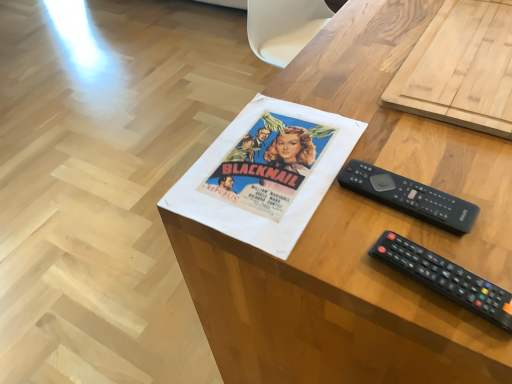
Measure the distance between woodendesk at center and camera.

woodendesk at center and camera are 16.77 inches apart.

Measure the distance between black plastic remote at center right, the first remote control positioned from the top, and camera.

black plastic remote at center right, the first remote control positioned from the top, is 21.11 inches away from camera.

The height and width of the screenshot is (384, 512). What do you see at coordinates (445, 278) in the screenshot? I see `black plastic remote at lower right, positioned as the first remote control in bottom-to-top order` at bounding box center [445, 278].

Measure the distance between black plastic remote at lower right, the first remote control positioned from the front, and camera.

They are 16.77 inches apart.

Locate an element on the screen. woodendesk at center is located at coordinates (360, 237).

From a real-world perspective, is black plastic remote at lower right, the second remote control in the back-to-front sequence, above or below woodendesk at center?

From a real-world perspective, black plastic remote at lower right, the second remote control in the back-to-front sequence, is physically above woodendesk at center.

Is black plastic remote at lower right, the first remote control positioned from the front, at the left side of woodendesk at center?

Yes, black plastic remote at lower right, the first remote control positioned from the front, is to the left of woodendesk at center.

Is black plastic remote at lower right, the second remote control in the back-to-front sequence, bigger than woodendesk at center?

No.

Is black plastic remote at lower right, the first remote control positioned from the front, taller or shorter than woodendesk at center?

Considering their sizes, black plastic remote at lower right, the first remote control positioned from the front, has less height than woodendesk at center.

How different are the orientations of woodendesk at center and black plastic remote at center right, the first remote control positioned from the top, in degrees?

The angular difference between woodendesk at center and black plastic remote at center right, the first remote control positioned from the top, is 89.8 degrees.

Is woodendesk at center positioned behind black plastic remote at center right, the second remote control from the bottom?

That is False.

How far apart are woodendesk at center and black plastic remote at center right, the 1th remote control when ordered from back to front?

9.21 inches.

Would you consider woodendesk at center to be distant from black plastic remote at center right, the second remote control from the bottom?

woodendesk at center is near black plastic remote at center right, the second remote control from the bottom, not far away.

Considering the sizes of objects woodendesk at center and black plastic remote at lower right, which is the second remote control in top-to-bottom order, in the image provided, who is wider, woodendesk at center or black plastic remote at lower right, which is the second remote control in top-to-bottom order,?

woodendesk at center is wider.

Which is behind, point (420, 305) or point (435, 258)?

The point (435, 258) is farther from the camera.

From a real-world perspective, is woodendesk at center positioned under black plastic remote at lower right, the second remote control in the back-to-front sequence, based on gravity?

Yes, from a real-world perspective, woodendesk at center is under black plastic remote at lower right, the second remote control in the back-to-front sequence.

Looking at the image, does black plastic remote at center right, the first remote control positioned from the top, seem bigger or smaller compared to woodendesk at center?

Considering their sizes, black plastic remote at center right, the first remote control positioned from the top, takes up less space than woodendesk at center.

From the image's perspective, between black plastic remote at center right, the first remote control positioned from the top, and woodendesk at center, who is located below?

black plastic remote at center right, the first remote control positioned from the top.

Where is `desk above the black plastic remote at center right, the second remote control from the bottom (from the image's perspective)`? desk above the black plastic remote at center right, the second remote control from the bottom (from the image's perspective) is located at coordinates (360, 237).

From a real-world perspective, which is physically below, black plastic remote at center right, the second remote control in the front-to-back sequence, or woodendesk at center?

From a 3D spatial view, woodendesk at center is below.

Is black plastic remote at lower right, the second remote control in the back-to-front sequence, closer to the viewer compared to black plastic remote at center right, the 1th remote control when ordered from back to front?

Yes, black plastic remote at lower right, the second remote control in the back-to-front sequence, is closer to the camera.

Would you say black plastic remote at center right, the first remote control positioned from the top, is part of black plastic remote at lower right, which is the second remote control in top-to-bottom order,'s contents?

Actually, black plastic remote at center right, the first remote control positioned from the top, is outside black plastic remote at lower right, which is the second remote control in top-to-bottom order.

Considering the relative positions of black plastic remote at lower right, positioned as the first remote control in bottom-to-top order, and black plastic remote at center right, the second remote control in the front-to-back sequence, in the image provided, is black plastic remote at lower right, positioned as the first remote control in bottom-to-top order, to the right of black plastic remote at center right, the second remote control in the front-to-back sequence, from the viewer's perspective?

Correct, you'll find black plastic remote at lower right, positioned as the first remote control in bottom-to-top order, to the right of black plastic remote at center right, the second remote control in the front-to-back sequence.

From a real-world perspective, is black plastic remote at center right, the first remote control positioned from the top, positioned under black plastic remote at lower right, the second remote control in the back-to-front sequence, based on gravity?

Correct, in the physical world, black plastic remote at center right, the first remote control positioned from the top, is lower than black plastic remote at lower right, the second remote control in the back-to-front sequence.

Can you confirm if black plastic remote at center right, the second remote control from the bottom, is wider than black plastic remote at lower right, which is the second remote control in top-to-bottom order?

Indeed, black plastic remote at center right, the second remote control from the bottom, has a greater width compared to black plastic remote at lower right, which is the second remote control in top-to-bottom order.

How different are the orientations of black plastic remote at center right, the second remote control in the front-to-back sequence, and black plastic remote at lower right, the second remote control in the back-to-front sequence, in degrees?

8.87 degrees.

The image size is (512, 384). In order to click on desk in front of the black plastic remote at lower right, the first remote control positioned from the front in this screenshot , I will do `click(360, 237)`.

The image size is (512, 384). In order to click on desk above the black plastic remote at center right, the second remote control from the bottom (from the image's perspective) in this screenshot , I will do `click(360, 237)`.

Based on the photo, from the image, which object appears to be farther from black plastic remote at lower right, the first remote control positioned from the front, woodendesk at center or black plastic remote at center right, the second remote control in the front-to-back sequence?

woodendesk at center is further to black plastic remote at lower right, the first remote control positioned from the front.

Estimate the real-world distances between objects in this image. Which object is closer to black plastic remote at center right, the 1th remote control when ordered from back to front, black plastic remote at lower right, which is the second remote control in top-to-bottom order, or woodendesk at center?

black plastic remote at lower right, which is the second remote control in top-to-bottom order, lies closer to black plastic remote at center right, the 1th remote control when ordered from back to front, than the other object.

Considering their positions, is black plastic remote at center right, the second remote control from the bottom, positioned further to woodendesk at center than black plastic remote at lower right, positioned as the first remote control in bottom-to-top order?

Among the two, black plastic remote at lower right, positioned as the first remote control in bottom-to-top order, is located further to woodendesk at center.

From the image, which object appears to be nearer to black plastic remote at center right, the first remote control positioned from the top, woodendesk at center or black plastic remote at lower right, positioned as the first remote control in bottom-to-top order?

Based on the image, black plastic remote at lower right, positioned as the first remote control in bottom-to-top order, appears to be nearer to black plastic remote at center right, the first remote control positioned from the top.

Looking at the image, which one is located closer to black plastic remote at lower right, positioned as the first remote control in bottom-to-top order, black plastic remote at center right, the second remote control in the front-to-back sequence, or woodendesk at center?

black plastic remote at center right, the second remote control in the front-to-back sequence.

In the scene shown: Estimate the real-world distances between objects in this image. Which object is further from woodendesk at center, black plastic remote at lower right, the first remote control positioned from the front, or black plastic remote at center right, the 1th remote control when ordered from back to front?

Based on the image, black plastic remote at lower right, the first remote control positioned from the front, appears to be further to woodendesk at center.

You are a GUI agent. You are given a task and a screenshot of the screen. Output one action in this format:
    pyautogui.click(x=<x>, y=<y>)
    Task: Click on the remote control situated between black plastic remote at center right, the second remote control from the bottom, and woodendesk at center from left to right
    
    Given the screenshot: What is the action you would take?
    pyautogui.click(x=445, y=278)